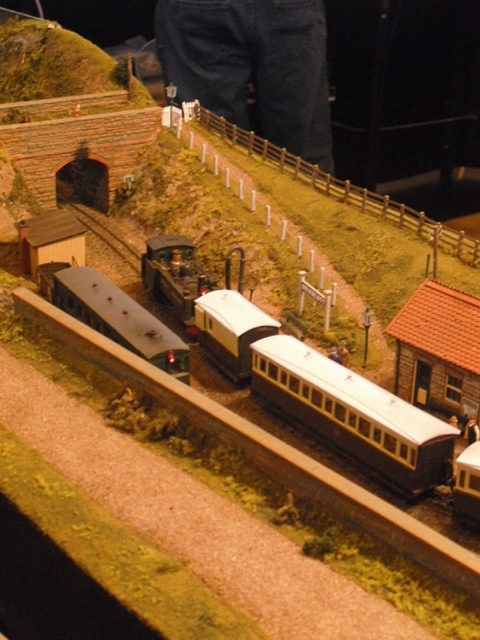
Question: Can you confirm if matte black train car at center is positioned to the right of matte silver train car at center?

Choices:
 (A) yes
 (B) no

Answer: (A)

Question: Which of the following is the farthest from the observer?

Choices:
 (A) matte silver train car at center
 (B) matte black train car at center

Answer: (A)

Question: Can you confirm if matte black train car at center is smaller than matte silver train car at center?

Choices:
 (A) no
 (B) yes

Answer: (B)

Question: Is matte black train car at center wider than matte silver train car at center?

Choices:
 (A) no
 (B) yes

Answer: (A)

Question: Among these objects, which one is farthest from the camera?

Choices:
 (A) matte black train car at center
 (B) matte silver train car at center

Answer: (B)